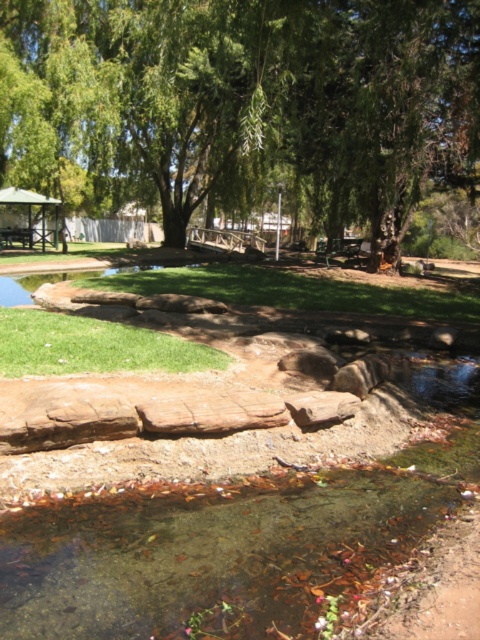
Can you confirm if green grass at center is wider than green grass at lower left?

Yes, green grass at center is wider than green grass at lower left.

Can you confirm if green grass at center is thinner than green grass at lower left?

Incorrect, green grass at center's width is not less than green grass at lower left's.

Find the location of `green grass at center`. green grass at center is located at coordinates (298, 291).

The image size is (480, 640). What do you see at coordinates (242, 104) in the screenshot? I see `green leafy tree at upper center` at bounding box center [242, 104].

From the picture: Between green leafy tree at upper center and green grass at center, which one appears on the right side from the viewer's perspective?

Positioned to the right is green grass at center.

Between point (251, 113) and point (262, 284), which one is positioned in front?

Point (251, 113)

Locate an element on the screen. The height and width of the screenshot is (640, 480). green leafy tree at upper center is located at coordinates [242, 104].

Does green leafy tree at upper center lie behind green grass at lower left?

Yes.

Measure the distance from green leafy tree at upper center to green grass at lower left.

green leafy tree at upper center is 14.43 meters from green grass at lower left.

Does point (109, 26) lie in front of point (142, 346)?

No, (109, 26) is behind (142, 346).

Find the location of a particular element. This screenshot has height=640, width=480. green leafy tree at upper center is located at coordinates (242, 104).